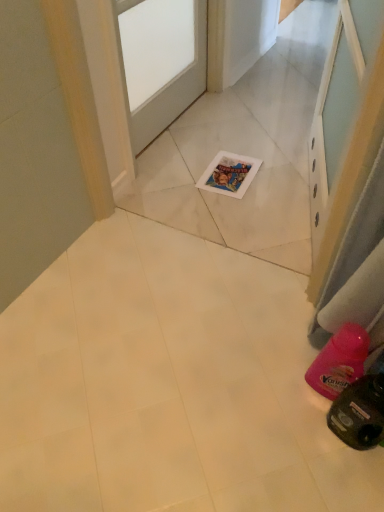
You are a GUI agent. You are given a task and a screenshot of the screen. Output one action in this format:
    pyautogui.click(x=<x>, y=<y>)
    Task: Click on the free space that is in between clear glass screen door at upper center and white matte door at center
    This screenshot has width=384, height=512.
    Given the screenshot: What is the action you would take?
    pyautogui.click(x=234, y=167)